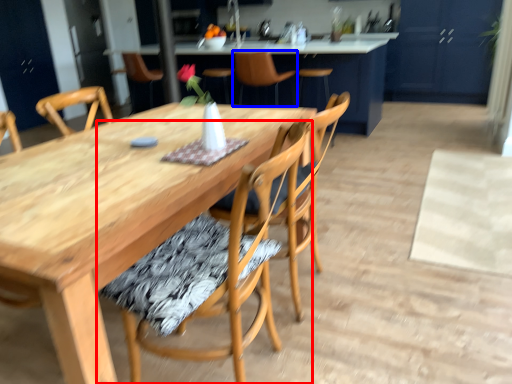
Question: Which object is closer to the camera taking this photo, chair (highlighted by a red box) or chair (highlighted by a blue box)?

Choices:
 (A) chair
 (B) chair

Answer: (A)